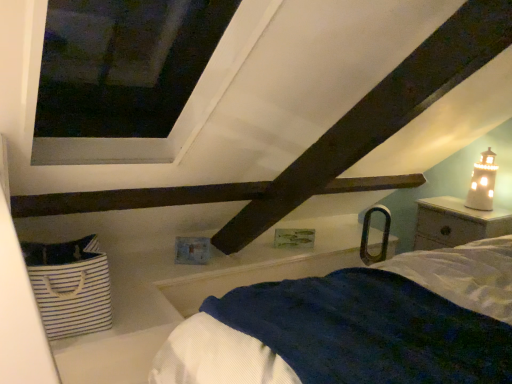
Question: From the image's perspective, is white wood nightstand at right on top of white ceramic lighthouse at upper right?

Choices:
 (A) yes
 (B) no

Answer: (B)

Question: Could you tell me if white wood nightstand at right is turned towards white ceramic lighthouse at upper right?

Choices:
 (A) yes
 (B) no

Answer: (B)

Question: Can you confirm if white wood nightstand at right is shorter than white ceramic lighthouse at upper right?

Choices:
 (A) no
 (B) yes

Answer: (A)

Question: Does white wood nightstand at right come in front of white ceramic lighthouse at upper right?

Choices:
 (A) no
 (B) yes

Answer: (B)

Question: Is white wood nightstand at right turned away from white ceramic lighthouse at upper right?

Choices:
 (A) no
 (B) yes

Answer: (A)

Question: Is white wood nightstand at right wider than white ceramic lighthouse at upper right?

Choices:
 (A) no
 (B) yes

Answer: (B)

Question: Is white striped fabric basket at lower left to the right of white ceramic lighthouse at upper right from the viewer's perspective?

Choices:
 (A) yes
 (B) no

Answer: (B)

Question: Is white striped fabric basket at lower left located outside white ceramic lighthouse at upper right?

Choices:
 (A) no
 (B) yes

Answer: (B)

Question: Can you confirm if white striped fabric basket at lower left is positioned to the left of white ceramic lighthouse at upper right?

Choices:
 (A) no
 (B) yes

Answer: (B)

Question: Does white striped fabric basket at lower left have a larger size compared to white ceramic lighthouse at upper right?

Choices:
 (A) yes
 (B) no

Answer: (A)

Question: From the image's perspective, is white striped fabric basket at lower left over white ceramic lighthouse at upper right?

Choices:
 (A) yes
 (B) no

Answer: (B)

Question: From a real-world perspective, is white striped fabric basket at lower left positioned over white ceramic lighthouse at upper right based on gravity?

Choices:
 (A) no
 (B) yes

Answer: (A)

Question: Can you confirm if white wood nightstand at right is wider than white striped fabric basket at lower left?

Choices:
 (A) yes
 (B) no

Answer: (A)